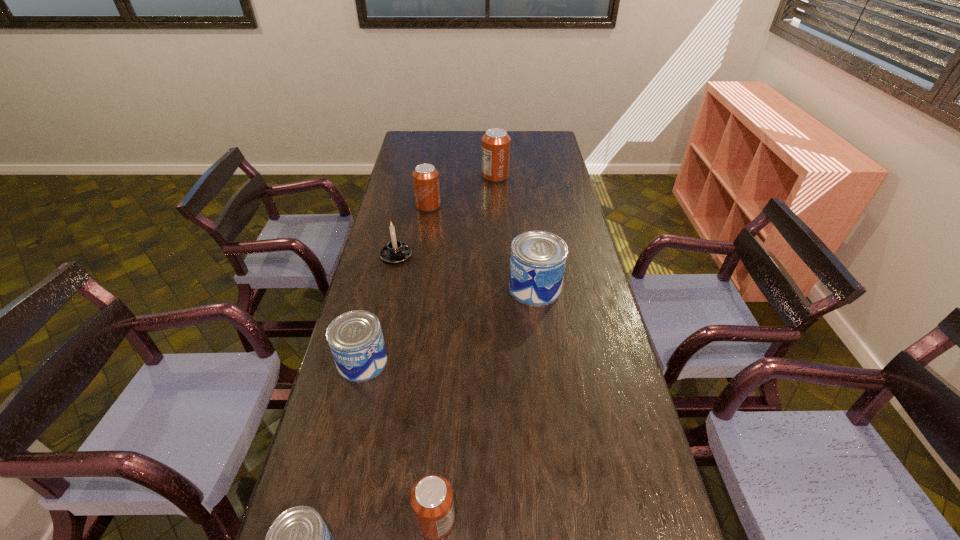
You are a GUI agent. You are given a task and a screenshot of the screen. Output one action in this format:
    pyautogui.click(x=<x>, y=<y>)
    Task: Click on the vacant space located 0.100m on the right of the sixth nearest can
    This screenshot has width=960, height=540.
    Given the screenshot: What is the action you would take?
    [x=465, y=206]

Find the location of a particular element. The image size is (960, 540). vacant space located 0.090m on the front label of the farthest blue can is located at coordinates (483, 288).

At what (x,y) coordinates should I click in order to perform the action: click on vacant point located 0.400m on the front label of the farthest blue can. Please return your answer as a coordinate pair (x, y). Looking at the image, I should click on (392, 288).

You are a GUI agent. You are given a task and a screenshot of the screen. Output one action in this format:
    pyautogui.click(x=<x>, y=<y>)
    Task: Click on the vacant region located on the front label of the farthest blue can
    The height and width of the screenshot is (540, 960).
    Given the screenshot: What is the action you would take?
    click(x=392, y=288)

Where is `blank space located 0.320m with a handle on the side of the third farthest object`? blank space located 0.320m with a handle on the side of the third farthest object is located at coordinates (498, 255).

You are a GUI agent. You are given a task and a screenshot of the screen. Output one action in this format:
    pyautogui.click(x=<x>, y=<y>)
    Task: Click on the free space located on the front label of the second smallest blue can
    The height and width of the screenshot is (540, 960).
    Given the screenshot: What is the action you would take?
    (x=453, y=362)

Locate an element on the screen. The width and height of the screenshot is (960, 540). candle holder located at the left edge is located at coordinates (395, 251).

The height and width of the screenshot is (540, 960). In order to click on object situated at the right edge in this screenshot , I will do `click(537, 263)`.

You are a GUI agent. You are given a task and a screenshot of the screen. Output one action in this format:
    pyautogui.click(x=<x>, y=<y>)
    Task: Click on the blank space at the far edge of the desktop
    The width and height of the screenshot is (960, 540).
    Given the screenshot: What is the action you would take?
    pyautogui.click(x=462, y=138)

In the image, there is a desktop. What are the coordinates of `free region at the left edge` in the screenshot? It's located at (428, 153).